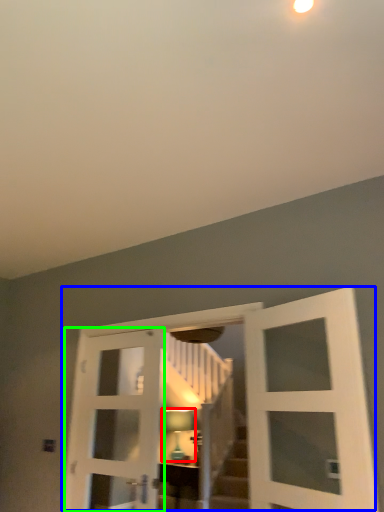
Question: Which object is positioned closest to light fixture (highlighted by a red box)? Select from door (highlighted by a blue box) and door (highlighted by a green box).

Choices:
 (A) door
 (B) door

Answer: (B)